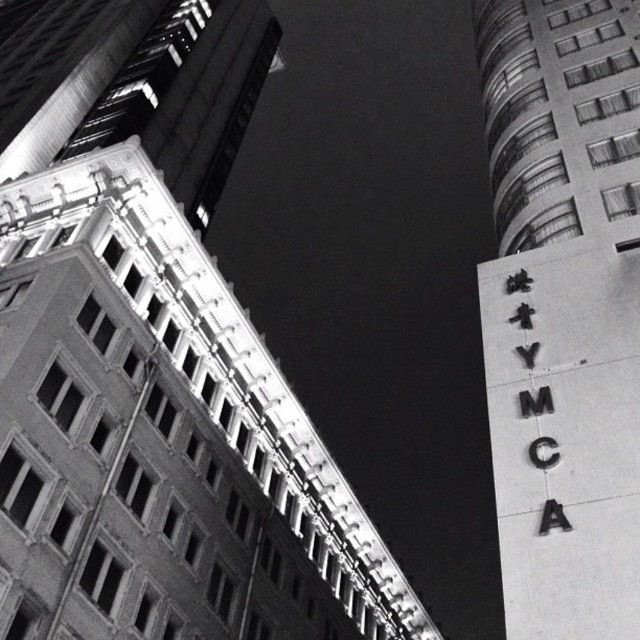
Can you confirm if metallic ymca sign at upper right is taller than smooth concrete building at left?

In fact, metallic ymca sign at upper right may be shorter than smooth concrete building at left.

Who is more distant from viewer, (x=544, y=172) or (x=90, y=109)?

The point (x=90, y=109) is more distant.

Find the location of a particular element. metallic ymca sign at upper right is located at coordinates (563, 308).